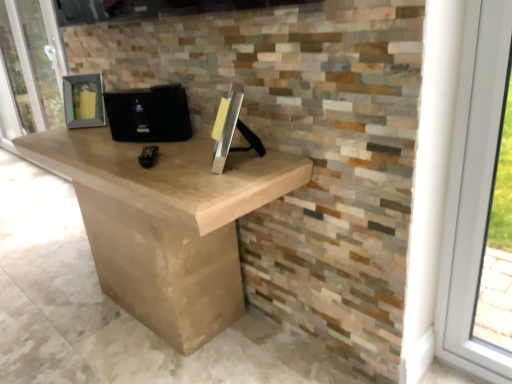
Where is `vacant space in front of matte gray frame at left`? This screenshot has height=384, width=512. vacant space in front of matte gray frame at left is located at coordinates (27, 187).